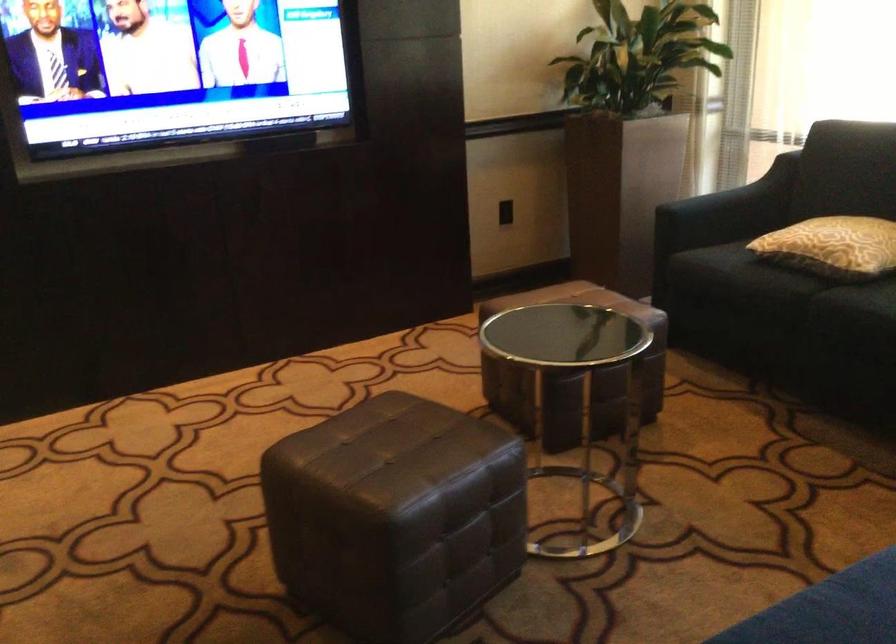
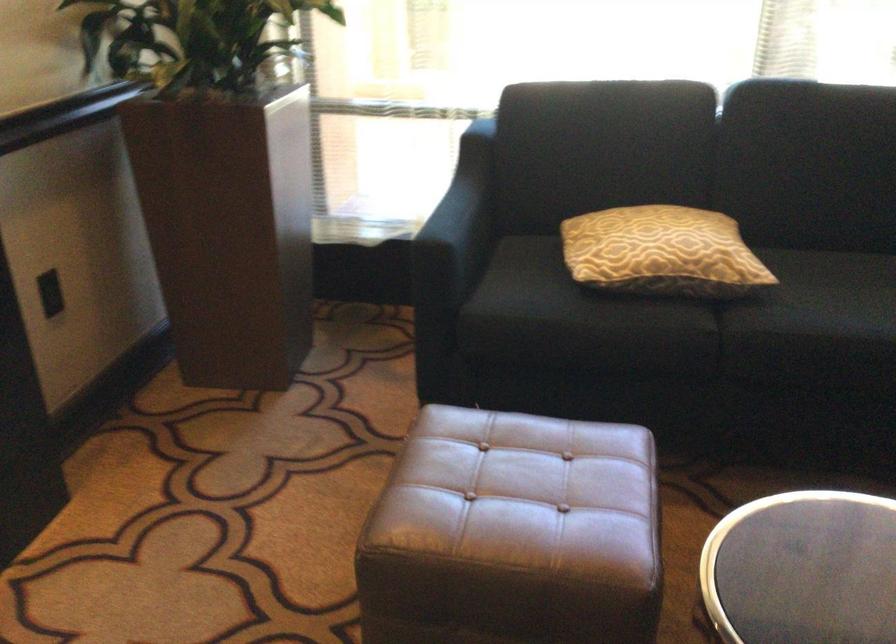
In the second image, find the point that corresponds to the point at 810,234 in the first image.

(661, 252)